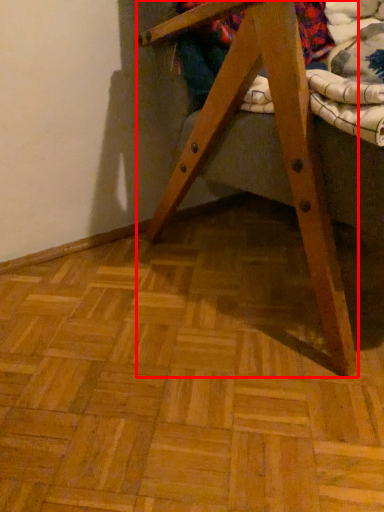
Question: In this image, where is furniture (annotated by the red box) located relative to underclothes?

Choices:
 (A) left
 (B) right

Answer: (B)